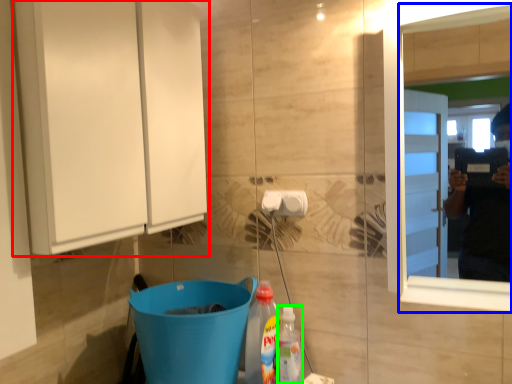
Question: Considering the real-world distances, which object is closest to cabinetry (highlighted by a red box)? mirror (highlighted by a blue box) or cleaning product (highlighted by a green box).

Choices:
 (A) mirror
 (B) cleaning product

Answer: (A)